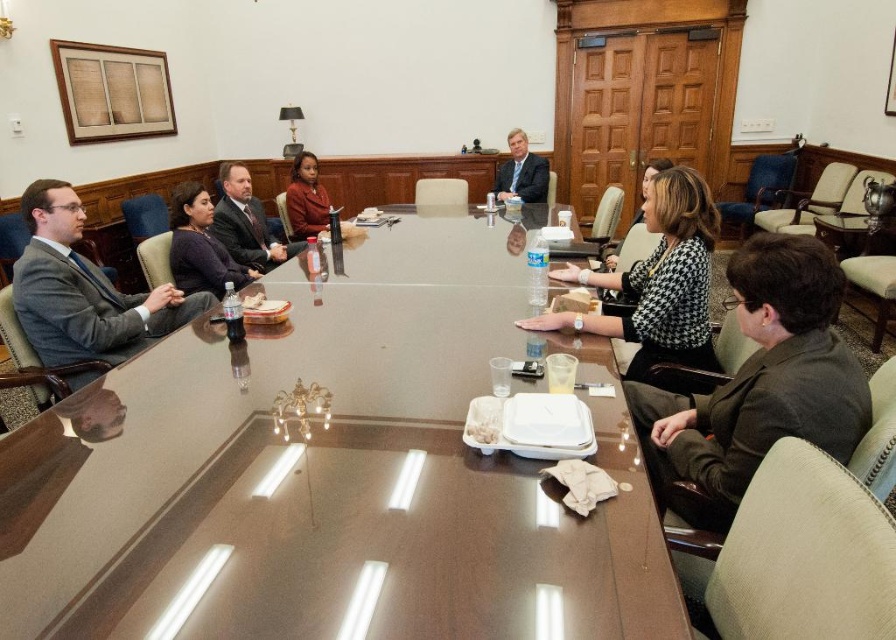
Between point (208, 221) and point (530, 168), which one is positioned in front?

Point (208, 221)

Between point (220, 273) and point (506, 161), which one is positioned in front?

Point (220, 273) is in front.

Where is `dark gray sweater at left`? Image resolution: width=896 pixels, height=640 pixels. dark gray sweater at left is located at coordinates (200, 244).

What do you see at coordinates (656, 282) in the screenshot?
I see `black houndstooth dress at center` at bounding box center [656, 282].

Can you confirm if black houndstooth dress at center is shorter than matte red jacket at center?

Incorrect, black houndstooth dress at center's height does not fall short of matte red jacket at center's.

Who is more forward, (672, 172) or (309, 230)?

Positioned in front is point (672, 172).

I want to click on black houndstooth dress at center, so click(x=656, y=282).

Between dark gray sweater at left and matte black suit at left, which one is positioned higher?

Positioned higher is matte black suit at left.

Is dark gray sweater at left to the left of matte black suit at left from the viewer's perspective?

Correct, you'll find dark gray sweater at left to the left of matte black suit at left.

Image resolution: width=896 pixels, height=640 pixels. In order to click on dark gray sweater at left in this screenshot , I will do `click(200, 244)`.

At what (x,y) coordinates should I click in order to perform the action: click on dark gray sweater at left. Please return your answer as a coordinate pair (x, y). Looking at the image, I should click on (200, 244).